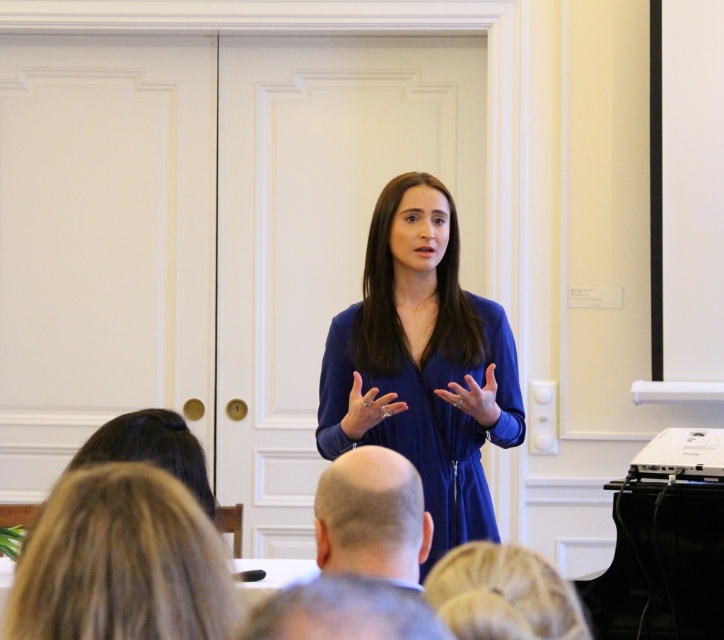
Question: Which of these objects is positioned closest to the gray hair at lower center?

Choices:
 (A) matte blue dress at center
 (B) blue fabric hand at center
 (C) bald head at center
 (D) blue silk dress at center

Answer: (C)

Question: Can you confirm if bald head at center is positioned to the left of gray hair at lower center?

Choices:
 (A) yes
 (B) no

Answer: (B)

Question: Which point appears farthest from the camera in this image?

Choices:
 (A) (391, 433)
 (B) (379, 483)

Answer: (A)

Question: Which of these objects is positioned farthest from the blue fabric hand at center?

Choices:
 (A) blue silk dress at lower center
 (B) matte blue dress at center
 (C) gray hair at lower center

Answer: (C)

Question: In this image, where is blue silk dress at center located relative to bald head at center?

Choices:
 (A) right
 (B) left

Answer: (A)

Question: Does gray hair at lower center have a larger size compared to matte blue dress at center?

Choices:
 (A) no
 (B) yes

Answer: (A)